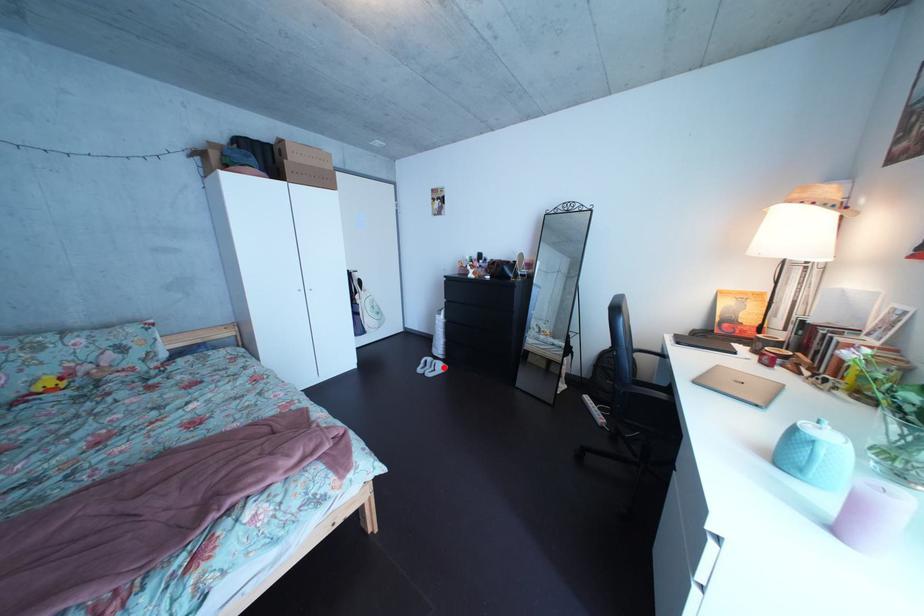
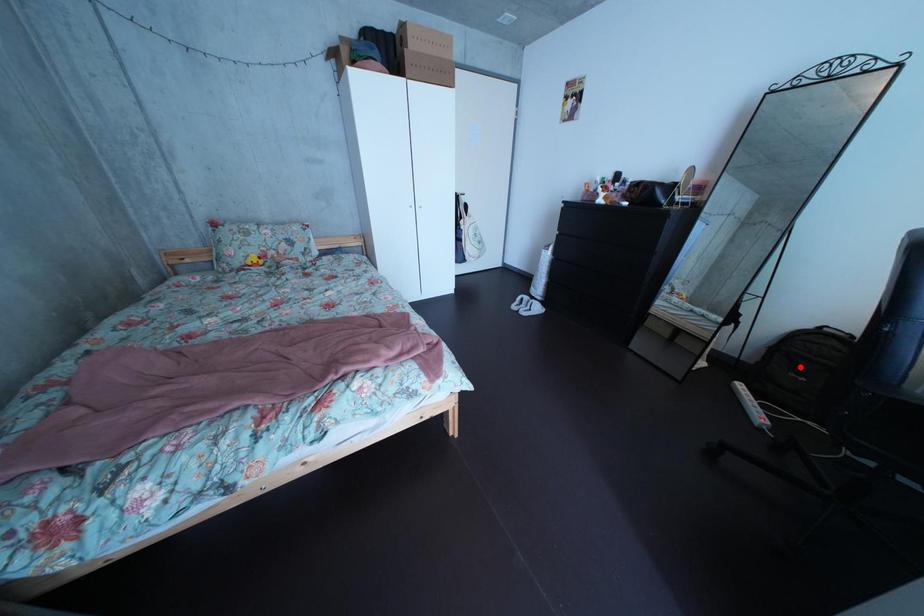
I am providing you with two images of the same scene from different viewpoints. A red point is marked on the first image and another point is marked on the second image. Are the points marked in image1 and image2 representing the same 3D position?

No